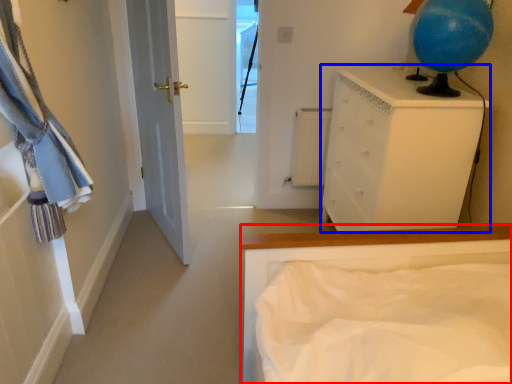
Question: Which point is further to the camera, bed (highlighted by a red box) or chest of drawers (highlighted by a blue box)?

Choices:
 (A) bed
 (B) chest of drawers

Answer: (B)